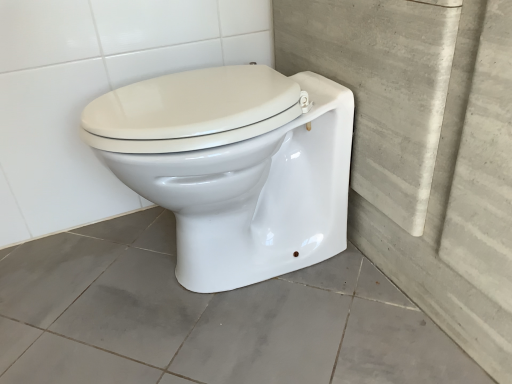
This screenshot has width=512, height=384. I want to click on white glossy toilet at center, so click(x=234, y=166).

Measure the distance between point (x=106, y=127) and camera.

71.70 centimeters.

Describe the element at coordinates (234, 166) in the screenshot. I see `white glossy toilet at center` at that location.

Where is `white glossy toilet at center`? white glossy toilet at center is located at coordinates (234, 166).